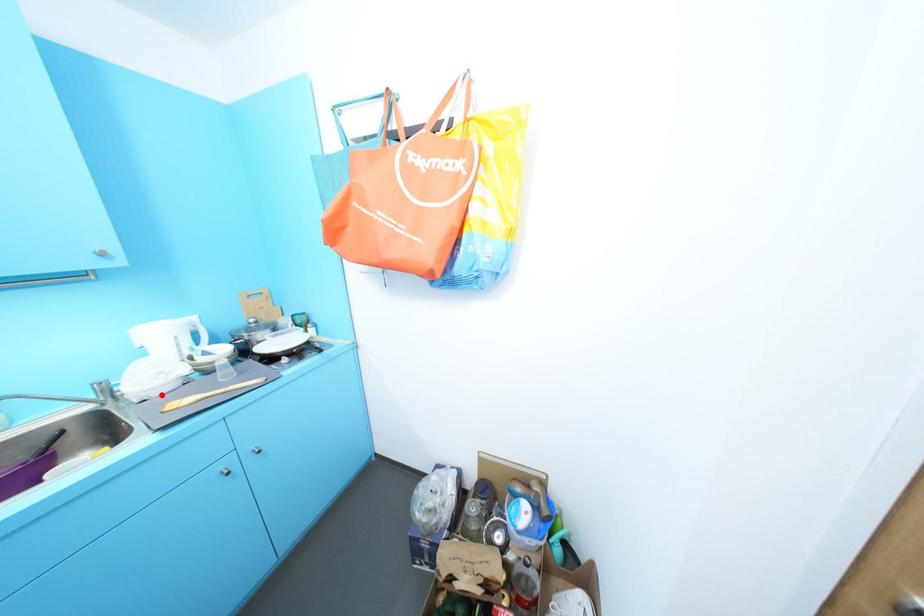
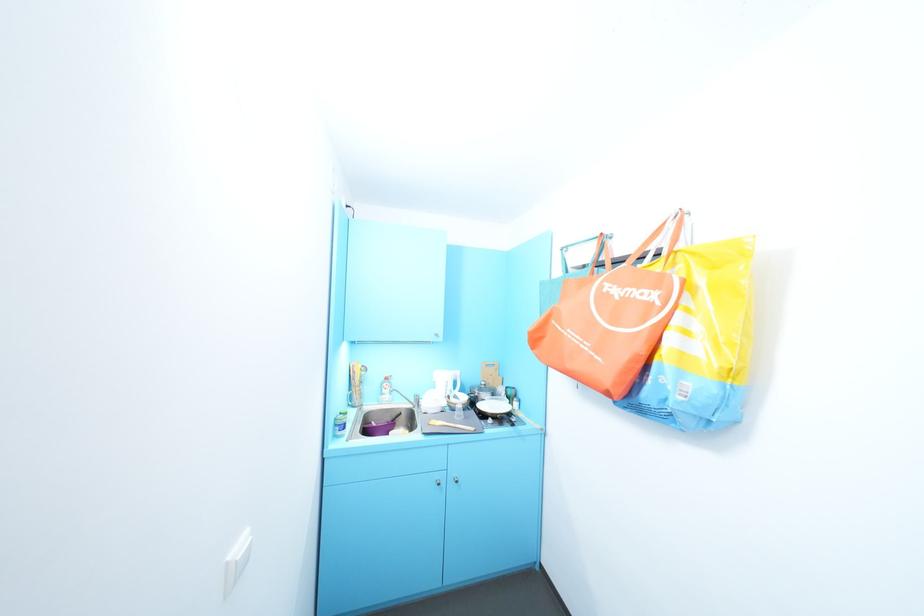
Question: I am providing you with two images of the same scene from different viewpoints. Image1 has a red point marked. In image2, the corresponding 3D location appears at what relative position? Reply with the corresponding letter.

Choices:
 (A) Closer
 (B) Farther

Answer: (B)